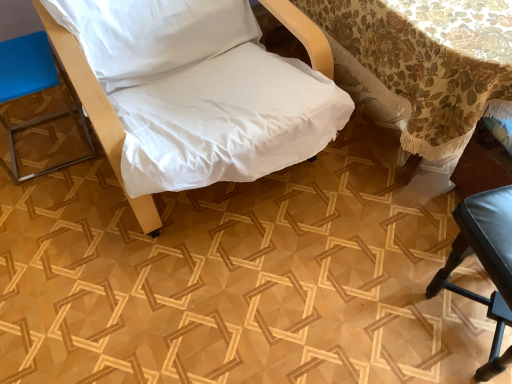
Question: Is white fabric chair at center, which is counted as the 2th furniture, starting from the left, bigger than blue leather stool at left, the 1th furniture when ordered from left to right?

Choices:
 (A) no
 (B) yes

Answer: (B)

Question: Is white fabric chair at center, which is counted as the second furniture, starting from the right, to the left of blue leather stool at left, the 1th furniture when ordered from left to right, from the viewer's perspective?

Choices:
 (A) no
 (B) yes

Answer: (A)

Question: Does white fabric chair at center, which is counted as the 2th furniture, starting from the left, turn towards blue leather stool at left, the 1th furniture when ordered from left to right?

Choices:
 (A) yes
 (B) no

Answer: (B)

Question: Considering the relative sizes of white fabric chair at center, which is counted as the second furniture, starting from the right, and blue leather stool at left, the 1th furniture when ordered from left to right, in the image provided, is white fabric chair at center, which is counted as the second furniture, starting from the right, taller than blue leather stool at left, the 1th furniture when ordered from left to right,?

Choices:
 (A) yes
 (B) no

Answer: (A)

Question: Is white fabric chair at center, which is counted as the second furniture, starting from the right, positioned beyond the bounds of blue leather stool at left, marked as the third furniture in a right-to-left arrangement?

Choices:
 (A) no
 (B) yes

Answer: (B)

Question: Considering their positions, is floral lace tablecloth at upper right located in front of or behind blue leather stool at left, marked as the third furniture in a right-to-left arrangement?

Choices:
 (A) behind
 (B) front

Answer: (B)

Question: From a real-world perspective, relative to blue leather stool at left, marked as the third furniture in a right-to-left arrangement, is floral lace tablecloth at upper right vertically above or below?

Choices:
 (A) above
 (B) below

Answer: (A)

Question: Looking at their shapes, would you say floral lace tablecloth at upper right is wider or thinner than blue leather stool at left, marked as the third furniture in a right-to-left arrangement?

Choices:
 (A) thin
 (B) wide

Answer: (B)

Question: From their relative heights in the image, would you say floral lace tablecloth at upper right is taller or shorter than blue leather stool at left, marked as the third furniture in a right-to-left arrangement?

Choices:
 (A) tall
 (B) short

Answer: (A)

Question: From a real-world perspective, is white fabric chair at center, which is counted as the second furniture, starting from the right, above or below blue leather stool at left, marked as the third furniture in a right-to-left arrangement?

Choices:
 (A) below
 (B) above

Answer: (B)

Question: Would you say white fabric chair at center, which is counted as the 2th furniture, starting from the left, is inside or outside blue leather stool at left, the 1th furniture when ordered from left to right?

Choices:
 (A) outside
 (B) inside

Answer: (A)

Question: Looking at the image, does white fabric chair at center, which is counted as the 2th furniture, starting from the left, seem bigger or smaller compared to blue leather stool at left, marked as the third furniture in a right-to-left arrangement?

Choices:
 (A) big
 (B) small

Answer: (A)

Question: Visually, is white fabric chair at center, which is counted as the 2th furniture, starting from the left, positioned to the left or to the right of blue leather stool at left, the 1th furniture when ordered from left to right?

Choices:
 (A) left
 (B) right

Answer: (B)

Question: Is floral lace tablecloth at upper right wider or thinner than black leather chair at lower right, which is the 1th furniture from right to left?

Choices:
 (A) wide
 (B) thin

Answer: (A)

Question: Is floral lace tablecloth at upper right to the left or to the right of black leather chair at lower right, which is the 1th furniture from right to left, in the image?

Choices:
 (A) left
 (B) right

Answer: (A)